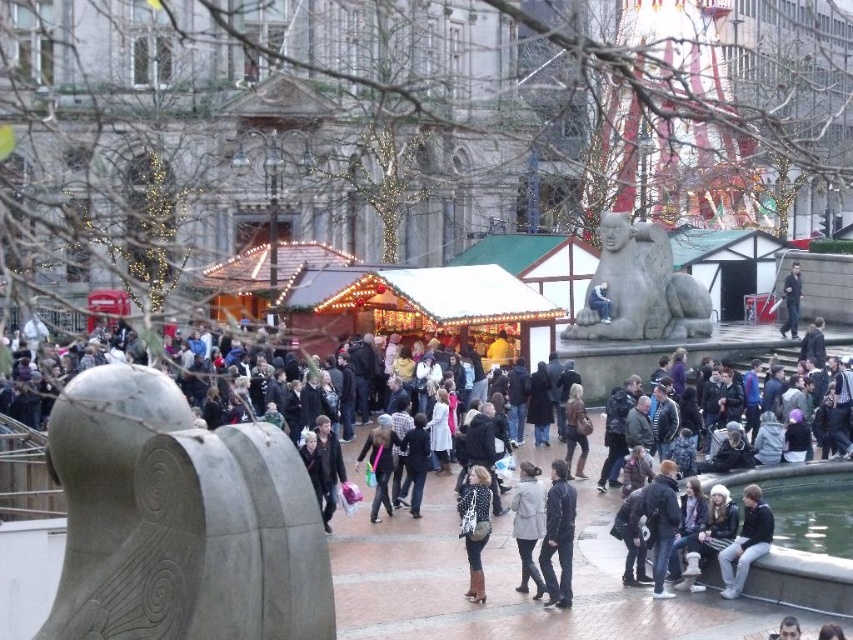
Which of these two, dark gray stone statue at lower right or matte gray coat at center, stands taller?

Standing taller between the two is dark gray stone statue at lower right.

Describe the element at coordinates (746, 541) in the screenshot. I see `dark gray stone statue at lower right` at that location.

Locate an element on the screen. dark gray stone statue at lower right is located at coordinates (746, 541).

In order to click on dark gray stone statue at lower right in this screenshot , I will do `click(746, 541)`.

Does gray stone sphinx at center lie in front of matte gray coat at center?

No, gray stone sphinx at center is further to the viewer.

Does point (664, 333) lie in front of point (523, 524)?

No, it is behind (523, 524).

Who is more forward, (x=585, y=337) or (x=523, y=520)?

Positioned in front is point (x=523, y=520).

Image resolution: width=853 pixels, height=640 pixels. In order to click on gray stone sphinx at center in this screenshot , I will do `click(640, 288)`.

Does matte gray coat at center appear on the right side of dark blue jacket at center?

No, matte gray coat at center is not to the right of dark blue jacket at center.

Can you confirm if matte gray coat at center is smaller than dark blue jacket at center?

Indeed, matte gray coat at center has a smaller size compared to dark blue jacket at center.

Describe the element at coordinates (527, 524) in the screenshot. The image size is (853, 640). I see `matte gray coat at center` at that location.

Locate an element on the screen. The image size is (853, 640). matte gray coat at center is located at coordinates click(527, 524).